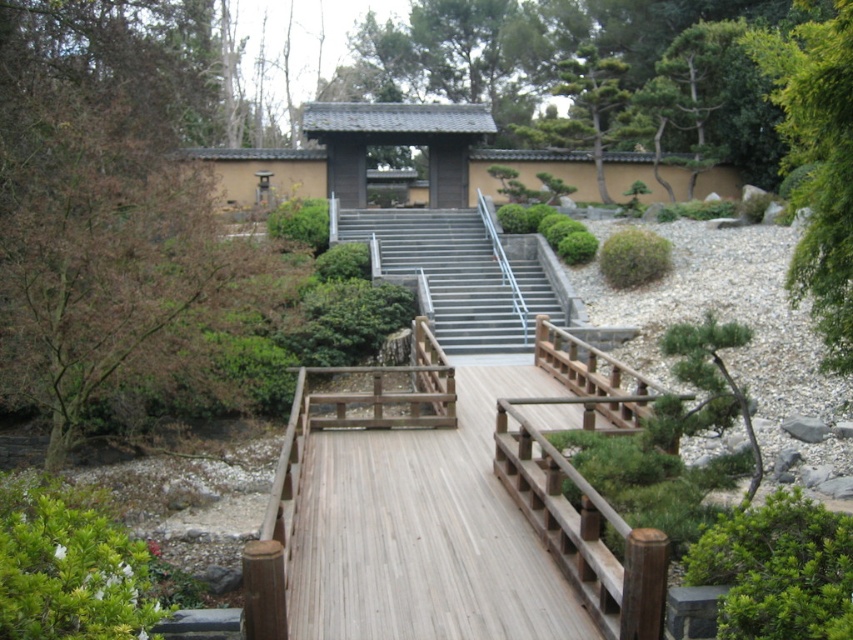
You are standing at the entrance of the garden and want to cross to the traditional building. The wooden bridge is your only path. Where exactly is the light brown wooden bridge at center located in the image?

The light brown wooden bridge at center is located at point (453, 508).

You are standing in the Japanese garden and want to take a photo. There are two points marked in the scene. The first point is at coordinates point (375, 564) and the second point is at point (845, 328). Which point is closer to your current position?

Point (375, 564) is closer to the camera than point (845, 328), so the first point is closer to your current position.

Looking at this image, you are a visitor in the garden and want to take a photo of both the green leafy tree at upper right and the metallic gray stairs at center. Can you stand at a spot where both are visible in the same frame without moving the camera? Explain why or why not.

The green leafy tree at upper right and metallic gray stairs at center are 23.09 feet apart from each other. Since they are positioned at a distance from one another, it is possible to find a vantage point where both can be captured in the same camera frame without moving the camera.